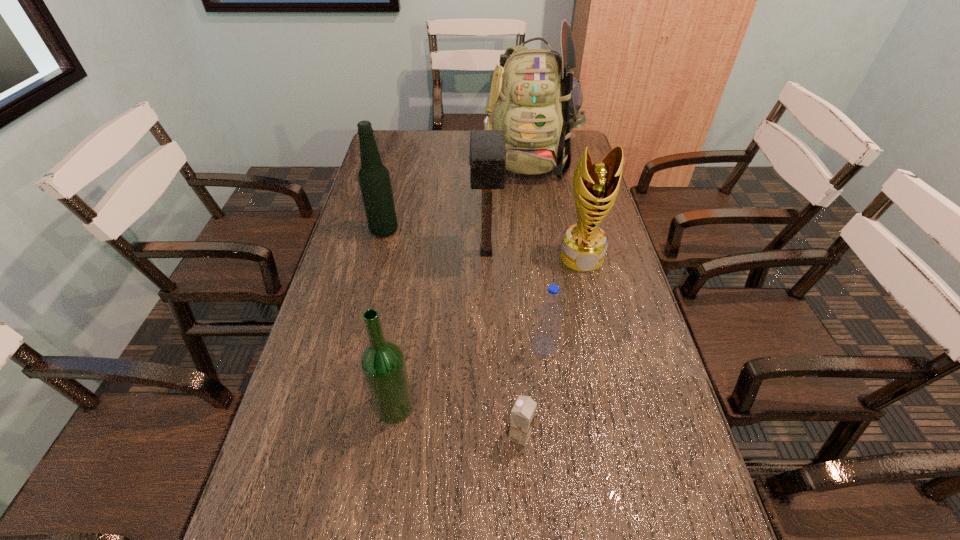
Where is `backpack at the right edge`? This screenshot has height=540, width=960. backpack at the right edge is located at coordinates (535, 99).

Find the location of a particular element. The height and width of the screenshot is (540, 960). award at the right edge is located at coordinates (595, 186).

The image size is (960, 540). What are the coordinates of `object that is at the far right corner` in the screenshot? It's located at (535, 99).

Where is `blank area at the left edge`? This screenshot has height=540, width=960. blank area at the left edge is located at coordinates (330, 416).

The height and width of the screenshot is (540, 960). In the image, there is a desktop. What are the coordinates of `vacant space at the right edge` in the screenshot? It's located at [x=606, y=273].

Locate an element on the screen. vacant space at the far right corner is located at coordinates (582, 141).

Where is `empty location between the shortest object and the mallet`? The height and width of the screenshot is (540, 960). empty location between the shortest object and the mallet is located at coordinates (503, 344).

Locate an element on the screen. empty location between the mallet and the farthest object is located at coordinates (508, 205).

The image size is (960, 540). What are the coordinates of `free space between the shorter alcohol and the shortest object` in the screenshot? It's located at (457, 421).

The height and width of the screenshot is (540, 960). What are the coordinates of `vacant region between the farthest object and the water bottle` in the screenshot? It's located at (537, 251).